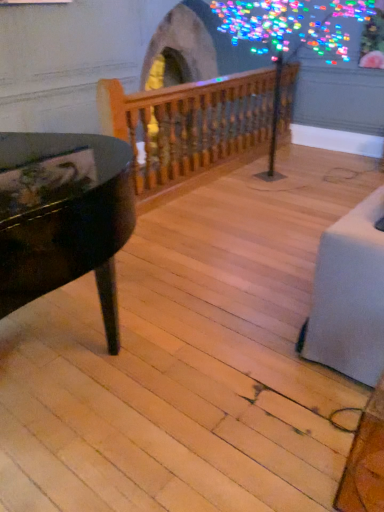
Measure the distance between point (x=179, y=145) and camera.

The distance of point (x=179, y=145) from camera is 3.62 meters.

What do you see at coordinates (189, 127) in the screenshot? Image resolution: width=384 pixels, height=512 pixels. I see `wooden baluster at center` at bounding box center [189, 127].

Where is `wooden baluster at center`? The height and width of the screenshot is (512, 384). wooden baluster at center is located at coordinates (189, 127).

This screenshot has height=512, width=384. Find the location of `wooden baluster at center`. wooden baluster at center is located at coordinates (189, 127).